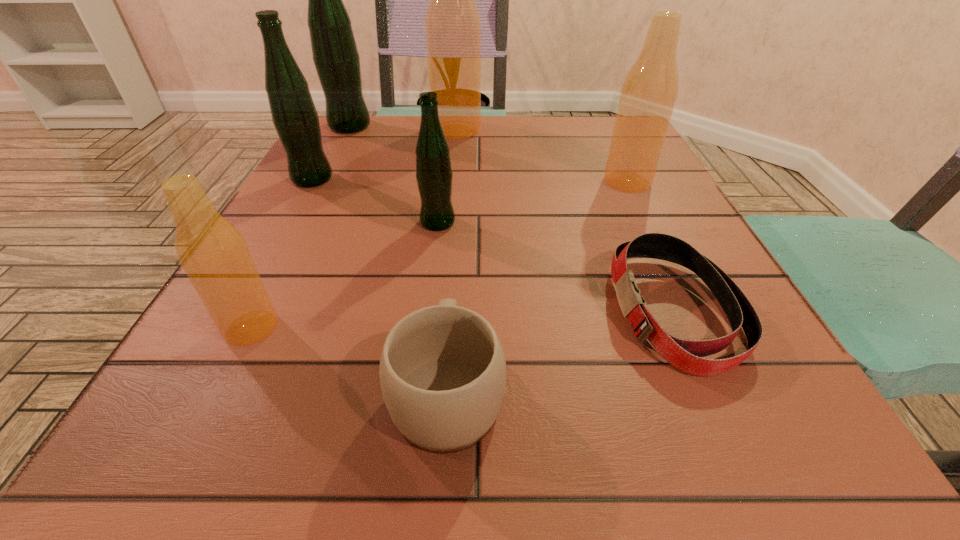
At what (x,y) coordinates should I click in order to perform the action: click on tan beer bottle identified as the third closest to the fifth farthest object. Please return your answer as a coordinate pair (x, y). The image size is (960, 540). Looking at the image, I should click on (452, 25).

Where is `free spot that satisfies the following two spatial constraints: 1. on the front side of the second smallest green beer bottle; 2. on the left side of the second nearest tan beer bottle`? The width and height of the screenshot is (960, 540). free spot that satisfies the following two spatial constraints: 1. on the front side of the second smallest green beer bottle; 2. on the left side of the second nearest tan beer bottle is located at coordinates (310, 182).

Find the location of a particular element. free space that satisfies the following two spatial constraints: 1. on the front side of the farthest green beer bottle; 2. on the right side of the biggest tan beer bottle is located at coordinates (348, 130).